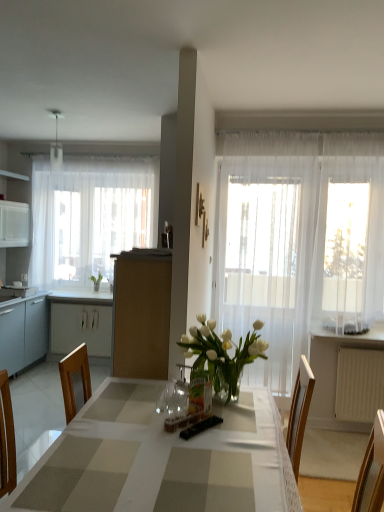
Question: Is white plastic radiator at lower right wider than checkered fabric table at center?

Choices:
 (A) no
 (B) yes

Answer: (A)

Question: Does white plastic radiator at lower right have a greater height compared to checkered fabric table at center?

Choices:
 (A) yes
 (B) no

Answer: (B)

Question: From the image's perspective, would you say white plastic radiator at lower right is positioned over checkered fabric table at center?

Choices:
 (A) yes
 (B) no

Answer: (A)

Question: Is white plastic radiator at lower right bigger than checkered fabric table at center?

Choices:
 (A) no
 (B) yes

Answer: (A)

Question: From a real-world perspective, does white plastic radiator at lower right sit lower than checkered fabric table at center?

Choices:
 (A) no
 (B) yes

Answer: (B)

Question: From the image's perspective, relative to white sheer curtain at left, the 2th curtain in the right-to-left sequence, is checkered fabric table at center above or below?

Choices:
 (A) below
 (B) above

Answer: (A)

Question: Is point (271, 476) positioned closer to the camera than point (92, 230)?

Choices:
 (A) farther
 (B) closer

Answer: (B)

Question: Would you say checkered fabric table at center is to the left or to the right of white sheer curtain at left, the 2th curtain in the right-to-left sequence, in the picture?

Choices:
 (A) left
 (B) right

Answer: (B)

Question: In terms of size, does checkered fabric table at center appear bigger or smaller than white sheer curtain at left, the first curtain from the left?

Choices:
 (A) small
 (B) big

Answer: (B)

Question: Considering the positions of white glossy counter top at lower left and green leafy plant at left in the image, is white glossy counter top at lower left taller or shorter than green leafy plant at left?

Choices:
 (A) tall
 (B) short

Answer: (B)

Question: Based on their positions, is white glossy counter top at lower left located to the left or right of green leafy plant at left?

Choices:
 (A) right
 (B) left

Answer: (B)

Question: In terms of size, does white glossy counter top at lower left appear bigger or smaller than green leafy plant at left?

Choices:
 (A) big
 (B) small

Answer: (A)

Question: Is white glossy counter top at lower left wider or thinner than green leafy plant at left?

Choices:
 (A) wide
 (B) thin

Answer: (A)

Question: From their relative heights in the image, would you say transparent fabric window at right is taller or shorter than green leafy plant at left?

Choices:
 (A) tall
 (B) short

Answer: (A)

Question: Is transparent fabric window at right in front of or behind green leafy plant at left in the image?

Choices:
 (A) front
 (B) behind

Answer: (A)